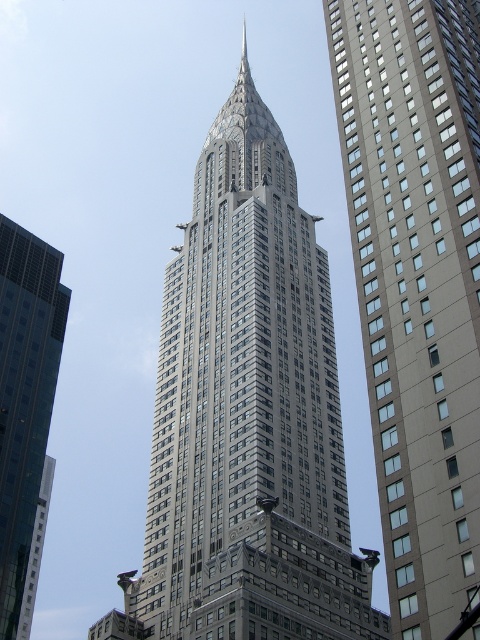
Does gray glass skyscraper at center have a larger size compared to glassy reflective skyscraper at left?

Yes, gray glass skyscraper at center is bigger than glassy reflective skyscraper at left.

Which of these two, gray glass skyscraper at center or glassy reflective skyscraper at left, stands taller?

Standing taller between the two is gray glass skyscraper at center.

Is point (375, 358) closer to camera compared to point (3, 632)?

Yes, point (375, 358) is in front of point (3, 632).

At what (x,y) coordinates should I click in order to perform the action: click on gray glass skyscraper at center. Please return your answer as a coordinate pair (x, y). Looking at the image, I should click on (417, 284).

Is point (310, 308) positioned after point (23, 378)?

No, (310, 308) is closer to viewer.

What are the coordinates of `gray metallic skyscraper at center` in the screenshot? It's located at (249, 413).

Can you confirm if gray metallic skyscraper at center is shorter than gray glass skyscraper at center?

No, gray metallic skyscraper at center is not shorter than gray glass skyscraper at center.

You are a GUI agent. You are given a task and a screenshot of the screen. Output one action in this format:
    pyautogui.click(x=<x>, y=<y>)
    Task: Click on the gray metallic skyscraper at center
    The height and width of the screenshot is (640, 480).
    Given the screenshot: What is the action you would take?
    pyautogui.click(x=249, y=413)